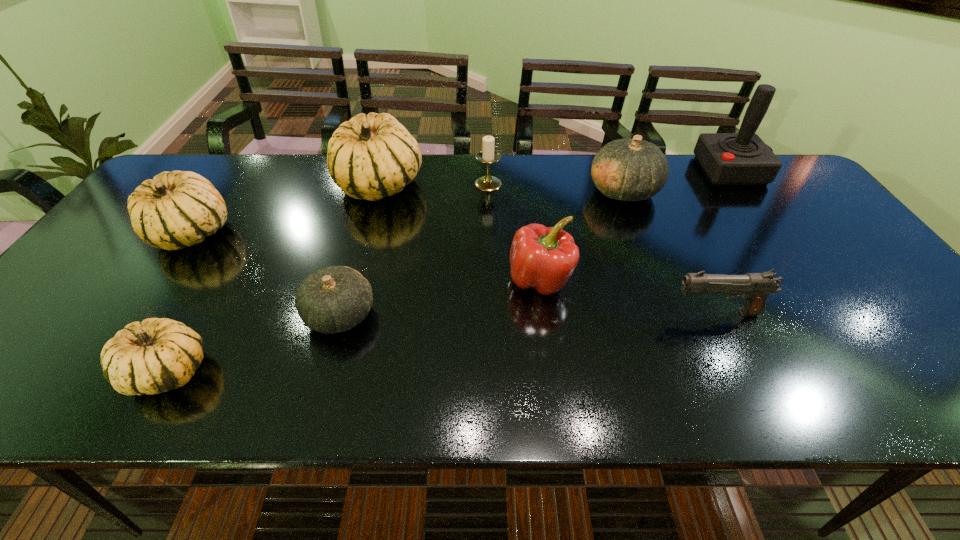
Locate an element on the screen. vacant space positioned on the right of the second biggest white gourd is located at coordinates (367, 233).

At what (x,y) coordinates should I click in order to perform the action: click on vacant space located 0.240m on the front of the fifth object from right to left. Please return your answer as a coordinate pair (x, y). This screenshot has height=540, width=960. Looking at the image, I should click on (490, 245).

Find the location of a particular element. free space located 0.220m on the left of the sixth object from left to right is located at coordinates (418, 280).

The height and width of the screenshot is (540, 960). I want to click on free spot located 0.060m in the direction the gray gun is aimed, so click(643, 313).

What are the coordinates of `free spot located 0.320m in the direction the gray gun is aimed` in the screenshot? It's located at pos(527,313).

Image resolution: width=960 pixels, height=540 pixels. Identify the location of vacant space located 0.280m in the direction the gray gun is aimed. (545, 313).

At what (x,y) coordinates should I click in order to perform the action: click on free space located on the back of the smaller orange gourd. Please return your answer as a coordinate pair (x, y). Looking at the image, I should click on (360, 244).

Locate an element on the screen. The image size is (960, 540). free space located on the right of the smallest white gourd is located at coordinates (258, 371).

In order to click on joystick located at the far edge in this screenshot , I will do `click(742, 158)`.

The height and width of the screenshot is (540, 960). Identify the location of candle holder located in the far edge section of the desktop. (488, 155).